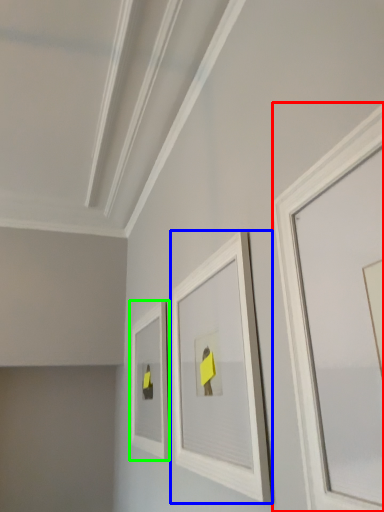
Question: Considering the real-world distances, which object is farthest from picture frame (highlighted by a red box)? picture frame (highlighted by a blue box) or picture frame (highlighted by a green box)?

Choices:
 (A) picture frame
 (B) picture frame

Answer: (B)